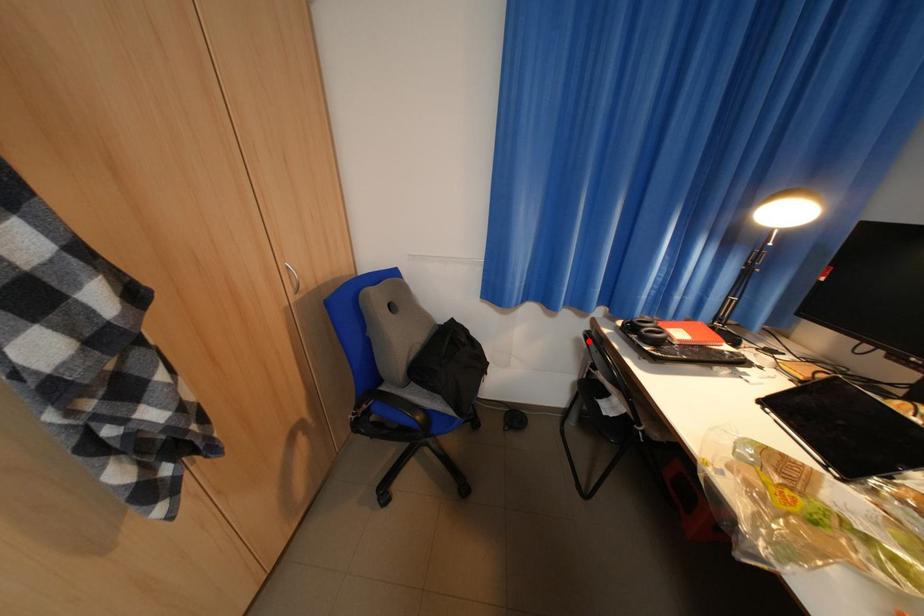
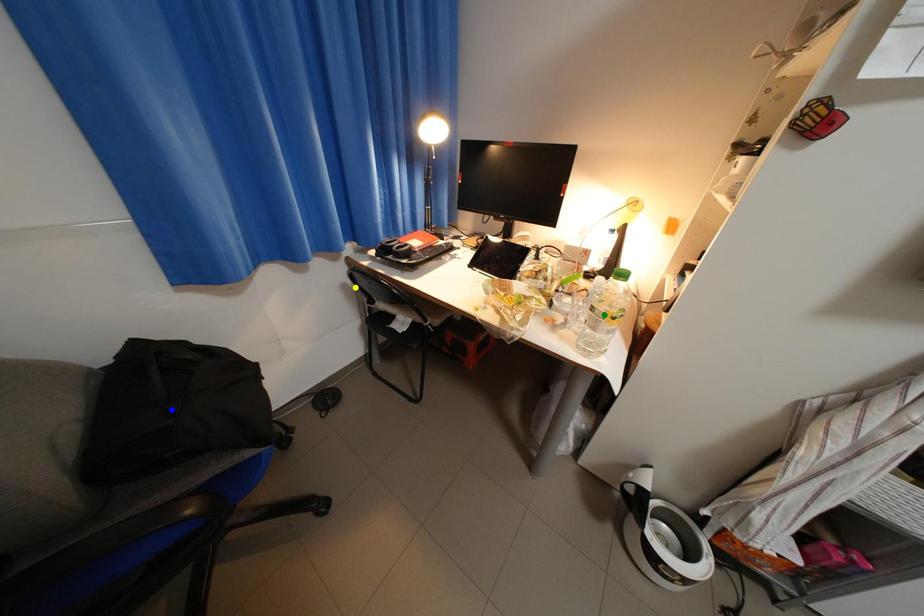
Question: I am providing you with two images of the same scene from different viewpoints. A red point is marked on the first image. You are given multiple points on the second image. Which point in image 2 is actually the same real-world point as the red point in image 1?

Choices:
 (A) blue point
 (B) green point
 (C) yellow point

Answer: (C)